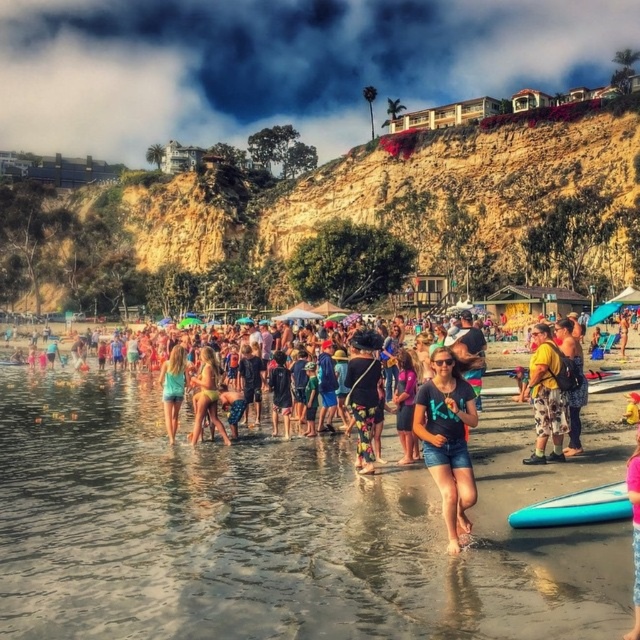
You are a photographer standing at the camera position. You want to take a photo of both the point at (362, 330) and the point at (632, 480). Which point will appear closer to the front of the photo?

Point at (362, 330) will appear closer to the front of the photo because it is further to the camera than point at (632, 480).